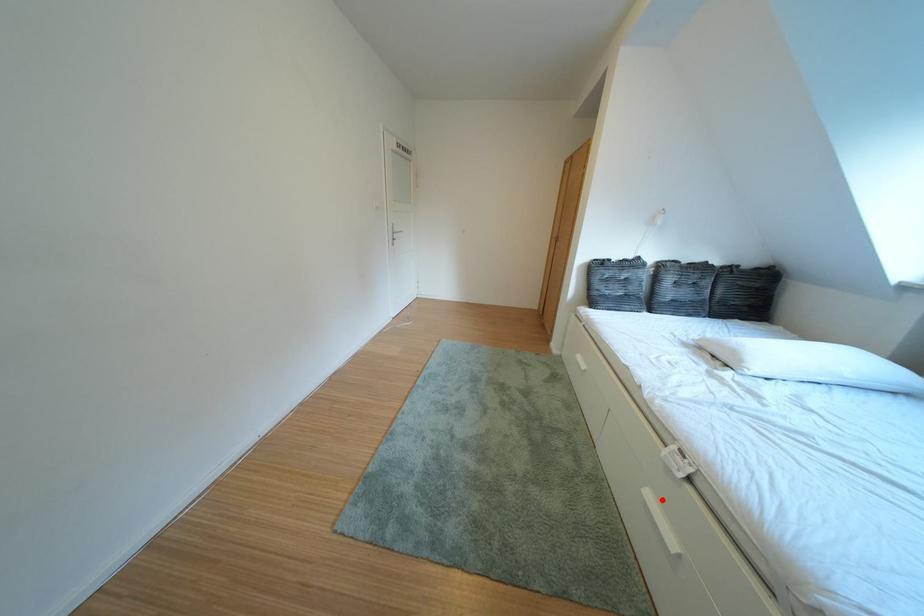
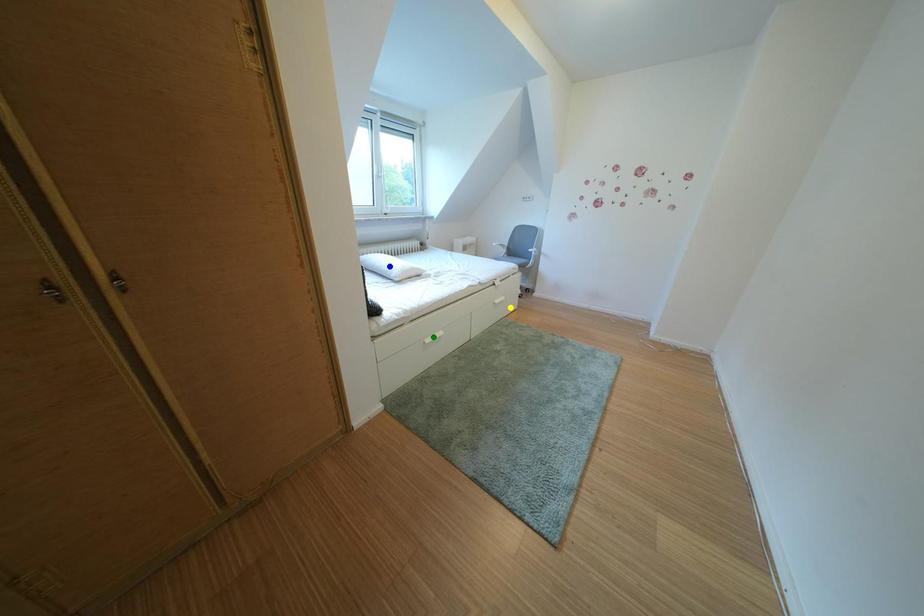
Question: I am providing you with two images of the same scene from different viewpoints. A red point is marked on the first image. You are given multiple points on the second image. Which mark in image 2 goes with the point in image 1?

Choices:
 (A) blue point
 (B) yellow point
 (C) green point

Answer: (B)